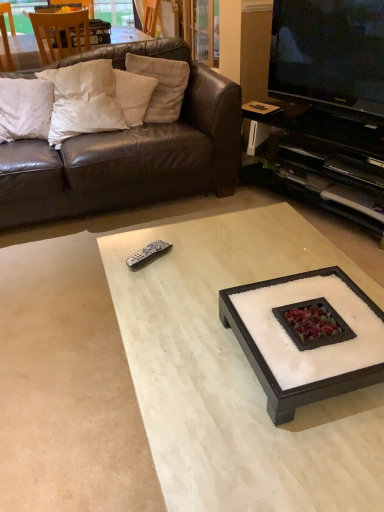
Question: Is black plastic cabinet at right closer to camera compared to white cotton pillow at upper left, the first pillow when ordered from right to left?

Choices:
 (A) yes
 (B) no

Answer: (A)

Question: Considering the relative sizes of black plastic cabinet at right and white cotton pillow at upper left, the first pillow when ordered from right to left, in the image provided, is black plastic cabinet at right smaller than white cotton pillow at upper left, the first pillow when ordered from right to left,?

Choices:
 (A) yes
 (B) no

Answer: (B)

Question: Considering the relative sizes of black plastic cabinet at right and white cotton pillow at upper left, the first pillow when ordered from right to left, in the image provided, is black plastic cabinet at right wider than white cotton pillow at upper left, the first pillow when ordered from right to left,?

Choices:
 (A) no
 (B) yes

Answer: (B)

Question: Does black plastic cabinet at right have a lesser height compared to white cotton pillow at upper left, which is the fourth pillow in left-to-right order?

Choices:
 (A) no
 (B) yes

Answer: (A)

Question: From a real-world perspective, is black plastic cabinet at right positioned over white cotton pillow at upper left, which is the fourth pillow in left-to-right order, based on gravity?

Choices:
 (A) no
 (B) yes

Answer: (A)

Question: Is black plastic cabinet at right positioned behind white cotton pillow at upper left, the first pillow when ordered from right to left?

Choices:
 (A) yes
 (B) no

Answer: (B)

Question: Is white marble coffee table at center, which is the 1th coffee table in bottom-to-top order, next to black plastic cabinet at right and touching it?

Choices:
 (A) no
 (B) yes

Answer: (A)

Question: Does white marble coffee table at center, which is the 1th coffee table in bottom-to-top order, have a lesser height compared to black plastic cabinet at right?

Choices:
 (A) yes
 (B) no

Answer: (A)

Question: Does white marble coffee table at center, positioned as the 2th coffee table in top-to-bottom order, have a greater width compared to black plastic cabinet at right?

Choices:
 (A) yes
 (B) no

Answer: (A)

Question: Can we say white marble coffee table at center, positioned as the 2th coffee table in top-to-bottom order, lies outside black plastic cabinet at right?

Choices:
 (A) no
 (B) yes

Answer: (B)

Question: Is white marble coffee table at center, positioned as the 2th coffee table in top-to-bottom order, to the left of black plastic cabinet at right from the viewer's perspective?

Choices:
 (A) no
 (B) yes

Answer: (B)

Question: Is white soft pillow at upper left, which ranks as the 3th pillow in right-to-left order, smaller than wooden chair at upper left?

Choices:
 (A) yes
 (B) no

Answer: (A)